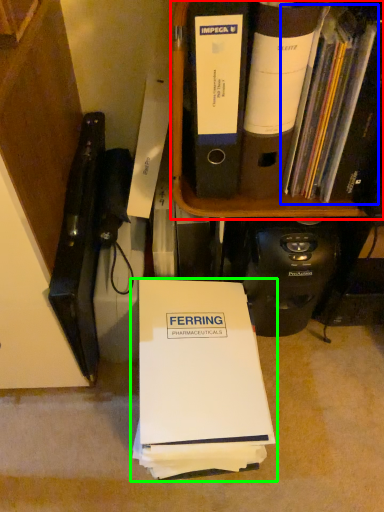
Question: Which is farther away from bookcase (highlighted by a red box)? book (highlighted by a blue box) or book (highlighted by a green box)?

Choices:
 (A) book
 (B) book

Answer: (B)